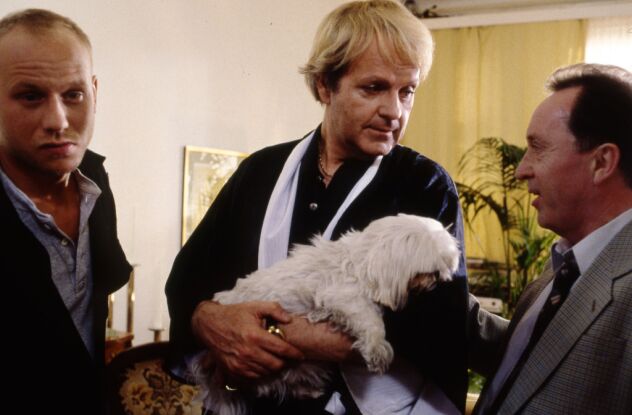
Identify the location of potted plant. This screenshot has height=415, width=632. (511, 154).